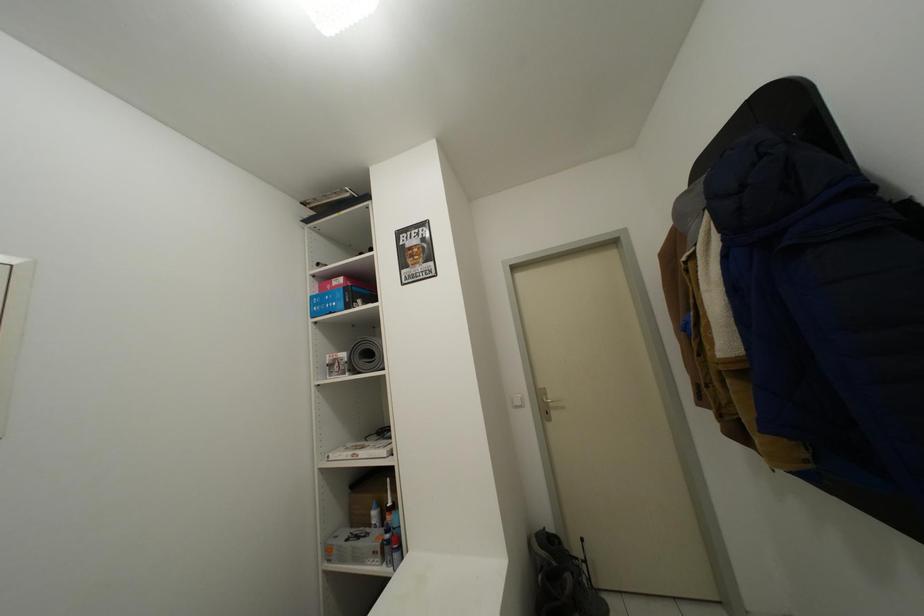
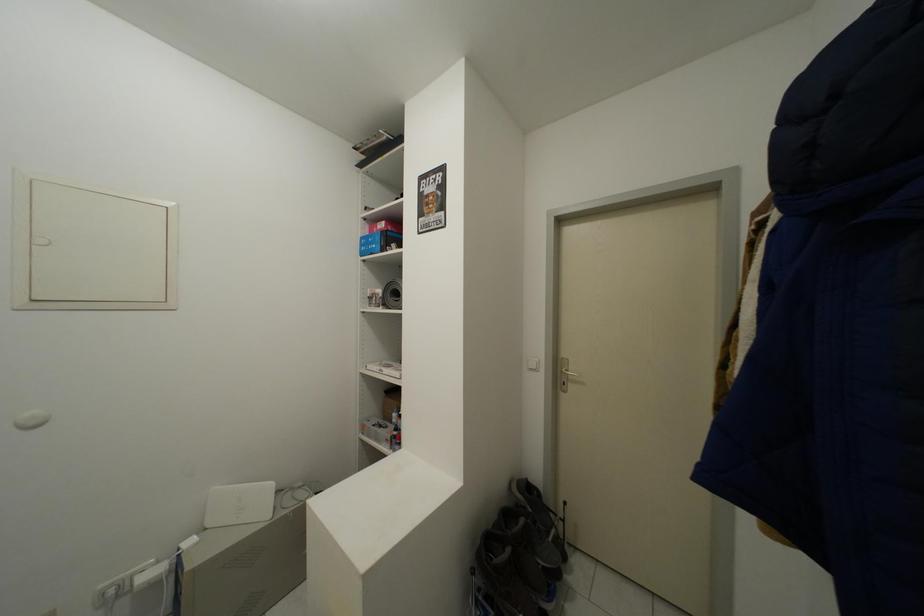
Question: The images are taken continuously from a first-person perspective. In which direction are you moving?

Choices:
 (A) Left
 (B) Right
 (C) Forward
 (D) Backward

Answer: (B)